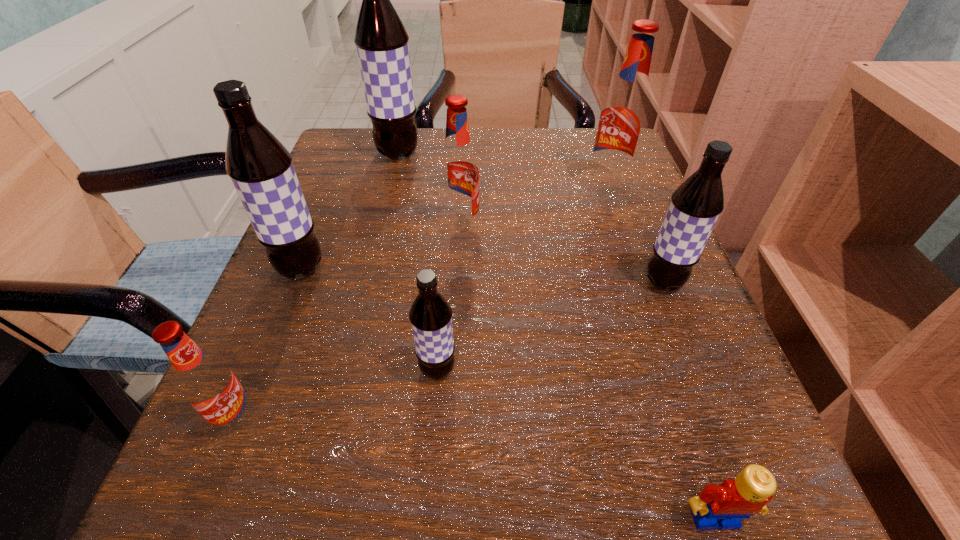
In the image, there is a desktop. Identify the location of free region at the far left corner. The width and height of the screenshot is (960, 540). (317, 174).

Where is `vacant space at the far right corner`? vacant space at the far right corner is located at coordinates (562, 157).

Where is `vacant area that lies between the tallest root beer and the sixth nearest object`? vacant area that lies between the tallest root beer and the sixth nearest object is located at coordinates (430, 191).

Find the location of a particular element. Image resolution: width=960 pixels, height=540 pixels. free space between the third biggest brown root beer and the shortest object is located at coordinates (689, 401).

Identify the location of vacant area that lies between the leftmost brown root beer and the third biggest brown root beer. This screenshot has height=540, width=960. (482, 275).

Locate an element on the screen. empty space between the biggest red root beer and the second nearest root beer is located at coordinates (522, 278).

You are a GUI agent. You are given a task and a screenshot of the screen. Output one action in this format:
    pyautogui.click(x=<x>, y=<y>)
    Task: Click on the free space between the smallest brown root beer and the Lego
    The height and width of the screenshot is (540, 960).
    Given the screenshot: What is the action you would take?
    pyautogui.click(x=576, y=444)

Find the location of a particular element. The image size is (960, 540). free space between the nearest object and the second farthest root beer is located at coordinates 660,353.

At what (x,y) coordinates should I click in order to perform the action: click on free area in between the leftmost brown root beer and the second smallest brown root beer. Please return your answer as a coordinate pair (x, y). Looking at the image, I should click on (482, 275).

Where is `vacant point located between the third nearest object and the second smallest brown root beer`? vacant point located between the third nearest object and the second smallest brown root beer is located at coordinates (550, 326).